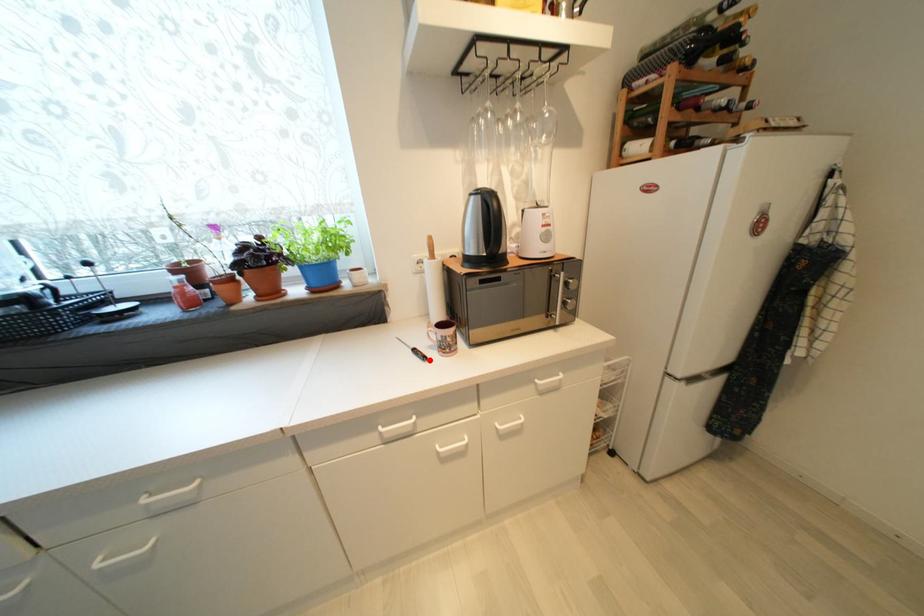
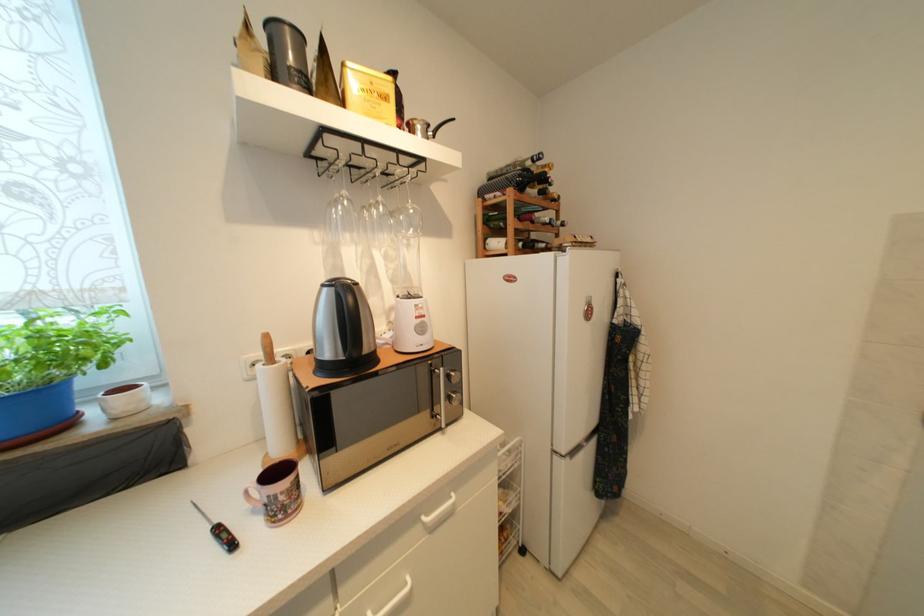
Find the pixel in the second image that matches the highlighted location in the first image.

(237, 546)